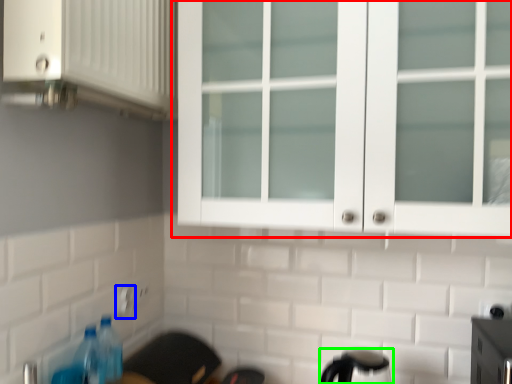
Question: Which is nearer to the cupboard (highlighted by a red box)? electric outlet (highlighted by a blue box) or appliance (highlighted by a green box).

Choices:
 (A) electric outlet
 (B) appliance

Answer: (B)